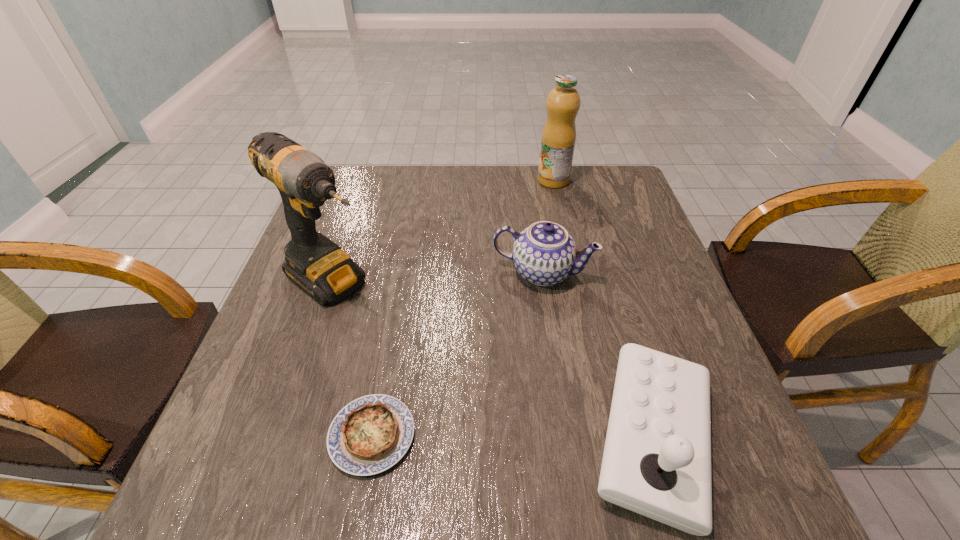
Identify the location of free space on the desktop that is between the quiche and the joystick and is positioned at the spout of the chinaware. The height and width of the screenshot is (540, 960). (486, 436).

Locate an element on the screen. vacant space on the desktop that is between the quiche and the joystick and is positioned with the drill bit of the drill facing forward is located at coordinates (549, 437).

Locate an element on the screen. free space on the desktop that is between the shortest object and the joystick and is positioned on the front label of the farthest object is located at coordinates (511, 436).